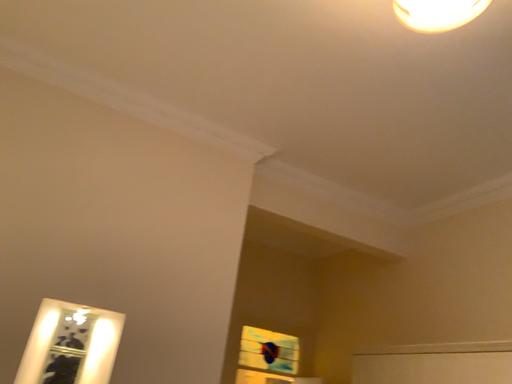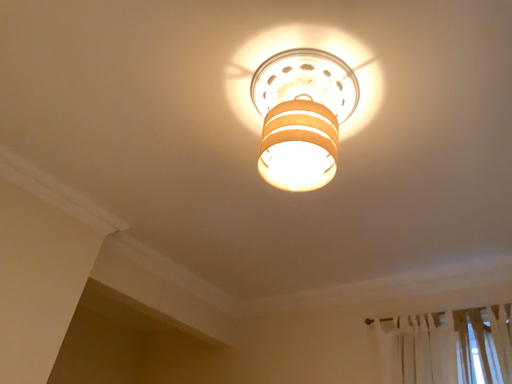
Question: How did the camera likely rotate when shooting the video?

Choices:
 (A) rotated left
 (B) rotated right

Answer: (B)